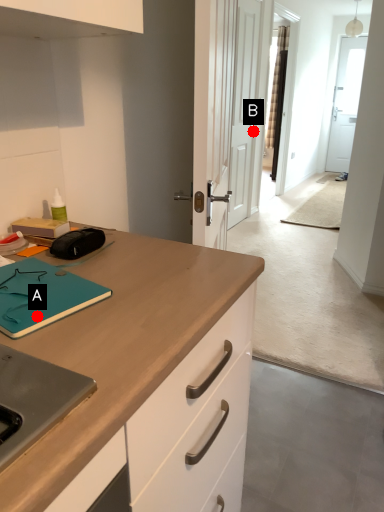
Question: Two points are circled on the image, labeled by A and B beside each circle. Which point is closer to the camera?

Choices:
 (A) A is closer
 (B) B is closer

Answer: (A)